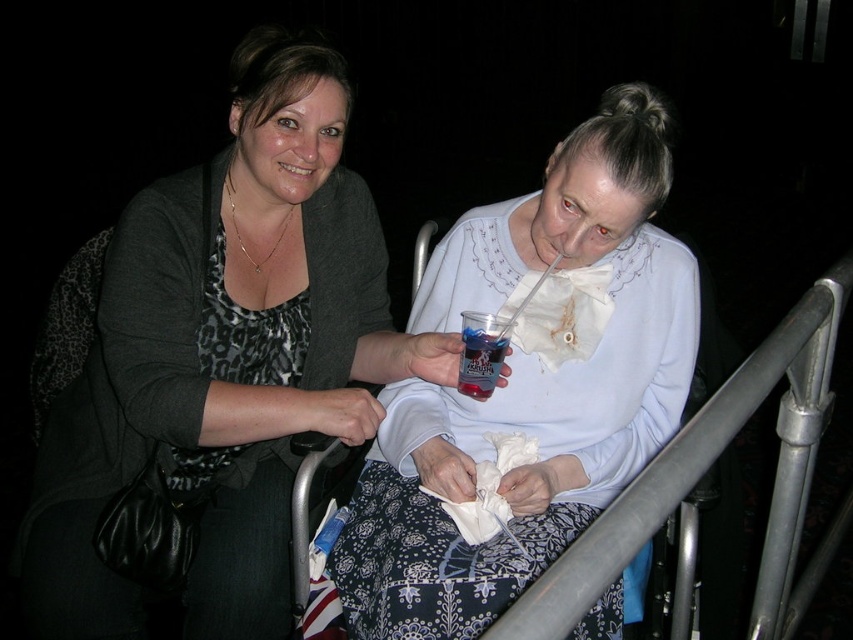
Looking at this image, you are a photographer trying to take a clear photo of the translucent plastic cup at center. However, the matte black sweater at center is blocking your view. Can you move the sweater to capture the cup?

The matte black sweater at center is in front of the translucent plastic cup at center, so moving the sweater would allow you to see the cup.

You are taking a photo of the two people in the scene. The first person is standing on the left, and the second person is seated on the right in a wheelchair. You want to focus on the point closer to the camera between the two points labeled as point (53, 477) and point (479, 403). Which point should you choose?

You should choose point (53, 477) because it is closer to the camera than point (479, 403).